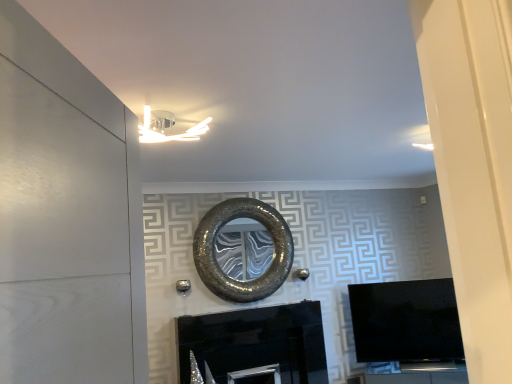
Locate an element on the screen. The width and height of the screenshot is (512, 384). black glossy fireplace at center is located at coordinates (254, 346).

What do you see at coordinates (219, 265) in the screenshot? The width and height of the screenshot is (512, 384). I see `shiny metallic mirror at center` at bounding box center [219, 265].

The height and width of the screenshot is (384, 512). Identify the location of white matte door at left. (67, 173).

Locate an element on the screen. This screenshot has width=512, height=384. black glossy fireplace at center is located at coordinates 254,346.

Consider the image. Is white matte door at left outside of black glossy tv at right?

That's correct, white matte door at left is outside of black glossy tv at right.

From the image's perspective, which one is positioned lower, white matte door at left or black glossy tv at right?

black glossy tv at right appears lower in the image.

From the picture: Is white matte door at left positioned before black glossy tv at right?

Yes, white matte door at left is in front of black glossy tv at right.

Is white matte door at left wider than black glossy tv at right?

In fact, white matte door at left might be narrower than black glossy tv at right.

Does black glossy tv at right touch white matte door at left?

No, black glossy tv at right is not touching white matte door at left.

Is black glossy tv at right shorter than white matte door at left?

Yes.

Is black glossy tv at right in front of or behind white matte door at left in the image?

Visually, black glossy tv at right is located behind white matte door at left.

Visually, is black glossy tv at right positioned to the left or to the right of white matte door at left?

Clearly, black glossy tv at right is on the right of white matte door at left in the image.

Does shiny metallic mirror at center touch black glossy tv at right?

No, shiny metallic mirror at center is not touching black glossy tv at right.

Consider the image. From the image's perspective, which one is positioned lower, shiny metallic mirror at center or black glossy tv at right?

black glossy tv at right, from the image's perspective.

Is shiny metallic mirror at center oriented towards black glossy tv at right?

No.

Does shiny metallic mirror at center appear on the right side of black glossy tv at right?

Incorrect, shiny metallic mirror at center is not on the right side of black glossy tv at right.

Between point (229, 215) and point (197, 378), which one is positioned behind?

The point (229, 215) is behind.

Is shiny metallic mirror at center in contact with black glossy fireplace at center?

shiny metallic mirror at center and black glossy fireplace at center are not in contact.

Can you confirm if shiny metallic mirror at center is taller than black glossy fireplace at center?

Yes.

Which object is thinner, shiny metallic mirror at center or black glossy fireplace at center?

Thinner between the two is shiny metallic mirror at center.

Is white matte door at left at the back of black glossy fireplace at center?

black glossy fireplace at center does not have its back to white matte door at left.

Which of these two, black glossy fireplace at center or white matte door at left, stands shorter?

Standing shorter between the two is black glossy fireplace at center.

Considering the sizes of objects black glossy tv at right and black glossy fireplace at center in the image provided, who is taller, black glossy tv at right or black glossy fireplace at center?

black glossy tv at right.

Which is behind, black glossy tv at right or black glossy fireplace at center?

black glossy tv at right is more distant.

From a real-world perspective, which object rests below the other?

black glossy tv at right, from a real-world perspective.

From the image's perspective, which one is positioned lower, black glossy tv at right or shiny metallic mirror at center?

black glossy tv at right is shown below in the image.

Which object is wider, black glossy tv at right or shiny metallic mirror at center?

Wider between the two is black glossy tv at right.

Which point is more forward, (x=398, y=294) or (x=205, y=228)?

Positioned in front is point (x=205, y=228).

Where is `door above the black glossy tv at right (from a real-world perspective)`? Image resolution: width=512 pixels, height=384 pixels. door above the black glossy tv at right (from a real-world perspective) is located at coordinates (67, 173).

Identify the location of door that appears above the black glossy tv at right (from the image's perspective). (67, 173).

When comparing their distances from shiny metallic mirror at center, does black glossy tv at right or white matte door at left seem further?

white matte door at left.

Estimate the real-world distances between objects in this image. Which object is further from white matte door at left, black glossy fireplace at center or black glossy tv at right?

black glossy tv at right.

Looking at the image, which one is located closer to black glossy fireplace at center, black glossy tv at right or white matte door at left?

black glossy tv at right lies closer to black glossy fireplace at center than the other object.

Looking at this image, based on their spatial positions, is black glossy fireplace at center or shiny metallic mirror at center closer to white matte door at left?

shiny metallic mirror at center is positioned closer to the anchor white matte door at left.

Estimate the real-world distances between objects in this image. Which object is closer to shiny metallic mirror at center, black glossy tv at right or black glossy fireplace at center?

black glossy fireplace at center lies closer to shiny metallic mirror at center than the other object.

Estimate the real-world distances between objects in this image. Which object is further from white matte door at left, shiny metallic mirror at center or black glossy fireplace at center?

black glossy fireplace at center.

Estimate the real-world distances between objects in this image. Which object is closer to black glossy tv at right, shiny metallic mirror at center or black glossy fireplace at center?

Based on the image, black glossy fireplace at center appears to be nearer to black glossy tv at right.

Which object lies further to the anchor point black glossy fireplace at center, white matte door at left or shiny metallic mirror at center?

white matte door at left.

At what (x,y) coordinates should I click in order to perform the action: click on fireplace between white matte door at left and black glossy tv at right from front to back. Please return your answer as a coordinate pair (x, y). Image resolution: width=512 pixels, height=384 pixels. Looking at the image, I should click on (254, 346).

Identify the location of fireplace between white matte door at left and shiny metallic mirror at center in the front-back direction. (254, 346).

Where is `fireplace located between shiny metallic mirror at center and black glossy tv at right in the left-right direction`? The height and width of the screenshot is (384, 512). fireplace located between shiny metallic mirror at center and black glossy tv at right in the left-right direction is located at coordinates (254, 346).

Locate an element on the screen. This screenshot has height=384, width=512. oval positioned between white matte door at left and black glossy tv at right from near to far is located at coordinates (219, 265).